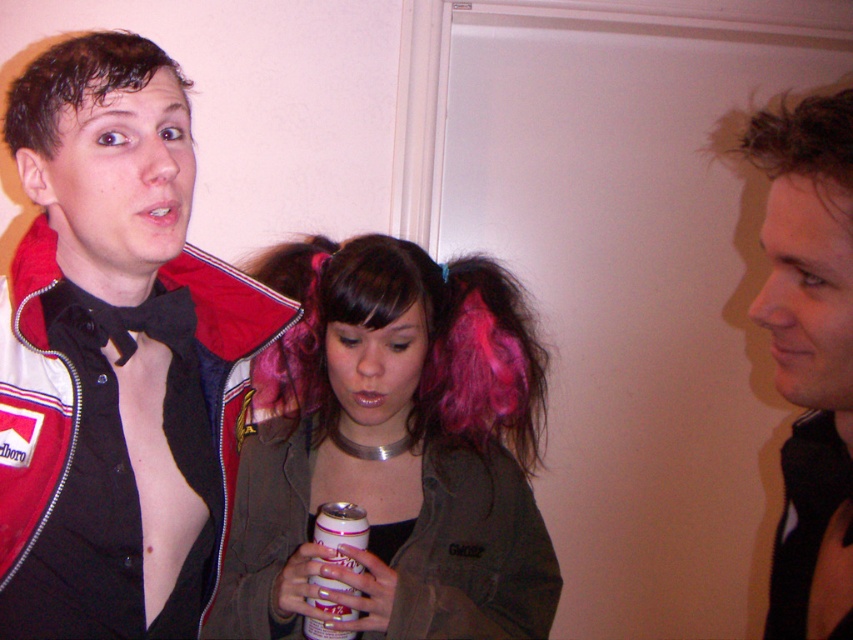
You are a photographer setting up a shoot in the room. You notice the wet brown hair at left and the white plastic can at center. Which object is closer to the camera?

The wet brown hair at left is closer to the camera because it is in front of the white plastic can at center.

You are a photographer in the room. You see the pink hair at center and the white plastic can at center. Which object is higher in the image?

The pink hair at center is higher than the white plastic can at center in the image.

You are standing in the room and want to reach both point [28,120] and point [346,534]. Which point should you go to first if you want to reach the closer one first?

You should go to point [28,120] first because it is closer to you than point [346,534].